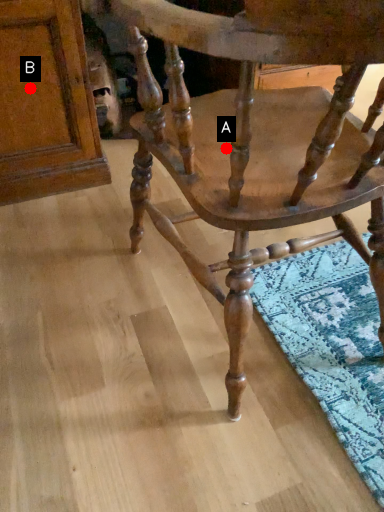
Question: Two points are circled on the image, labeled by A and B beside each circle. Among these points, which one is farthest from the camera?

Choices:
 (A) A is further
 (B) B is further

Answer: (B)